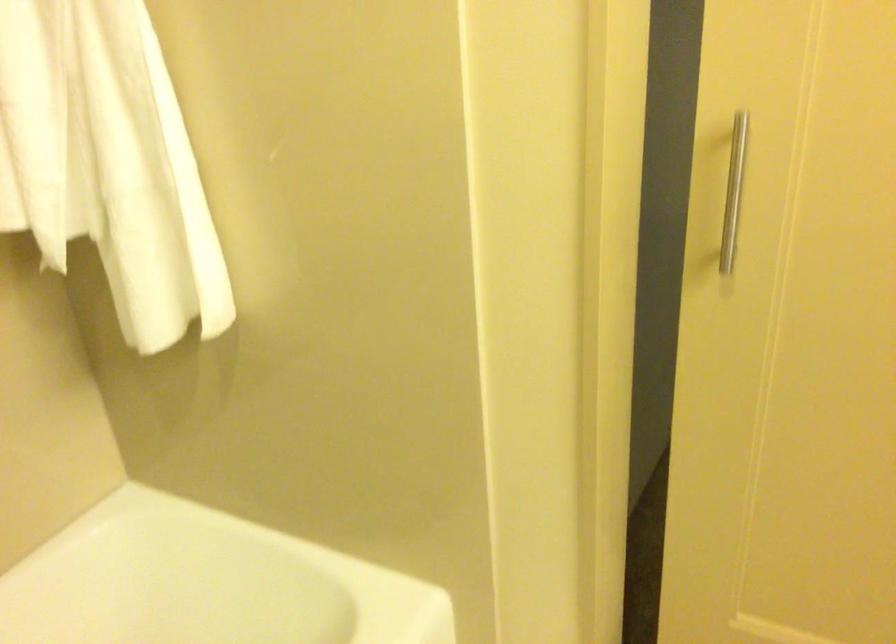
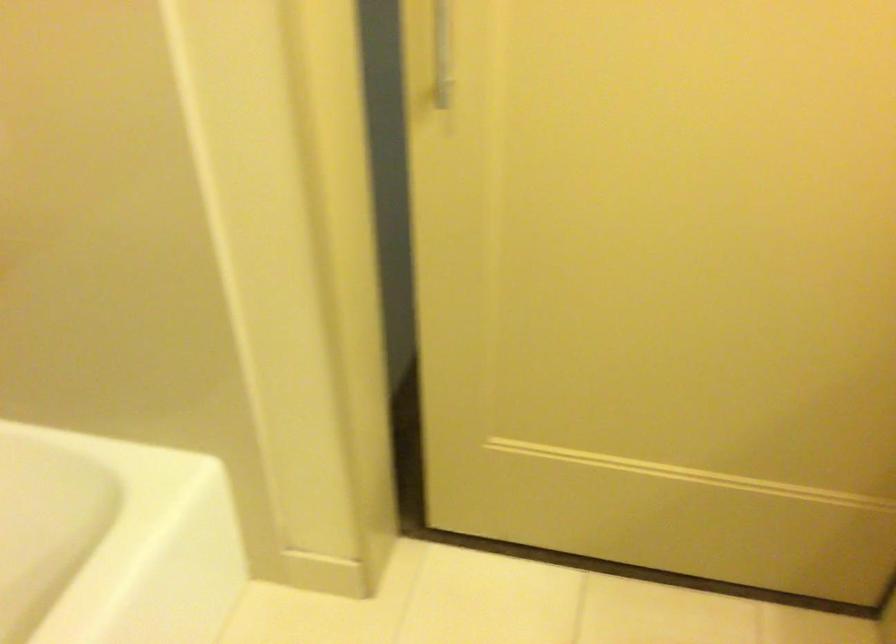
Question: The camera is either moving clockwise (left) or counter-clockwise (right) around the object. The first image is from the beginning of the video and the second image is from the end. Is the camera moving left or right when shooting the video?

Choices:
 (A) Left
 (B) Right

Answer: (A)